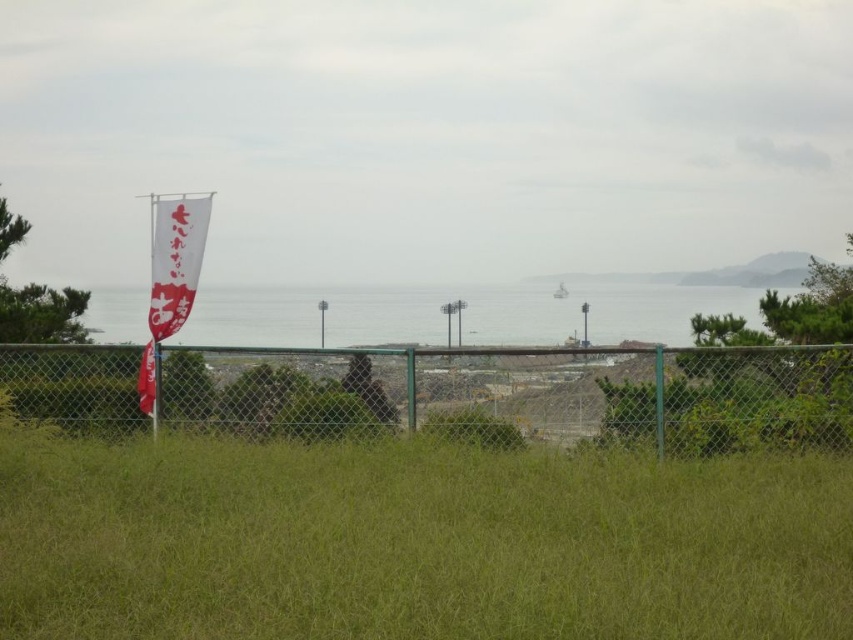
Question: Which point is closer to the camera taking this photo?

Choices:
 (A) (317, 368)
 (B) (663, 410)

Answer: (B)

Question: Which object appears farthest from the camera in this image?

Choices:
 (A) green chain-link fence at center
 (B) metallic chain-link fence at center

Answer: (B)

Question: Does green grass at center appear over green chain-link fence at center?

Choices:
 (A) no
 (B) yes

Answer: (A)

Question: From the image, what is the correct spatial relationship of green grass at center in relation to green chain-link fence at center?

Choices:
 (A) left
 (B) right

Answer: (A)

Question: Can you confirm if green chain-link fence at center is positioned to the left of metallic chain-link fence at center?

Choices:
 (A) yes
 (B) no

Answer: (A)

Question: Which point is closer to the camera?

Choices:
 (A) green chain-link fence at center
 (B) metallic chain-link fence at center
 (C) green grass at center
 (D) white paper flag at left

Answer: (C)